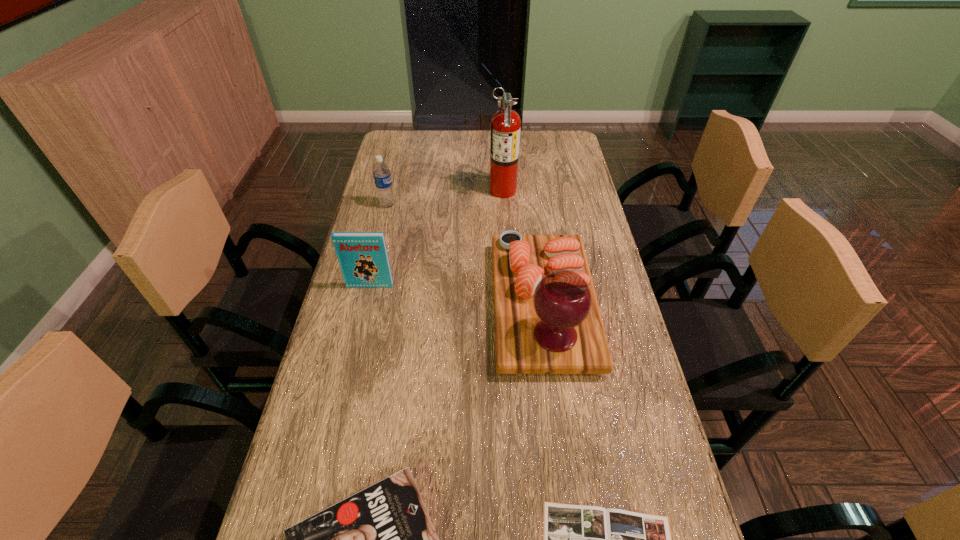
This screenshot has width=960, height=540. I want to click on book positioned at the left edge, so click(363, 258).

Identify the location of water bottle that is at the left edge. Image resolution: width=960 pixels, height=540 pixels. (381, 172).

Find the location of a particular element. Image resolution: width=960 pixels, height=540 pixels. object situated at the right edge is located at coordinates (547, 320).

This screenshot has width=960, height=540. In order to click on free space at the far edge in this screenshot , I will do `click(479, 150)`.

Find the location of `vacant space at the left edge of the desktop`. vacant space at the left edge of the desktop is located at coordinates [347, 451].

This screenshot has width=960, height=540. In the image, there is a desktop. Identify the location of vacant space at the right edge. (542, 185).

In the image, there is a desktop. Identify the location of vacant space at the far left corner. (387, 159).

I want to click on vacant point located between the tallest book and the fire extinguisher, so click(437, 238).

In order to click on vacant area that lies between the fire extinguisher and the farthest book in this screenshot , I will do `click(437, 238)`.

You are a GUI agent. You are given a task and a screenshot of the screen. Output one action in this format:
    pyautogui.click(x=<x>, y=<y>)
    Task: Click on the object that is the fourth nearest to the tallest object
    This screenshot has height=540, width=960.
    Given the screenshot: What is the action you would take?
    pyautogui.click(x=381, y=539)